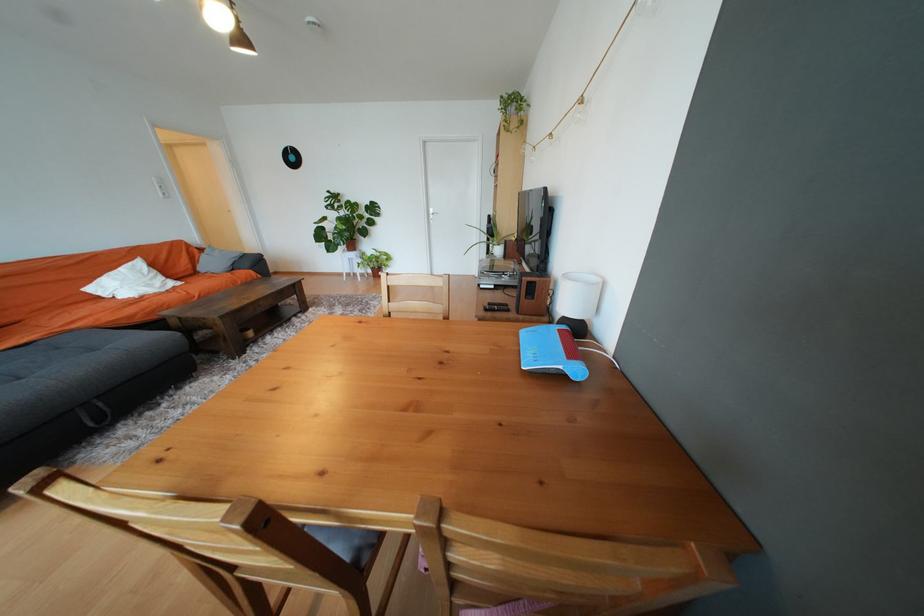
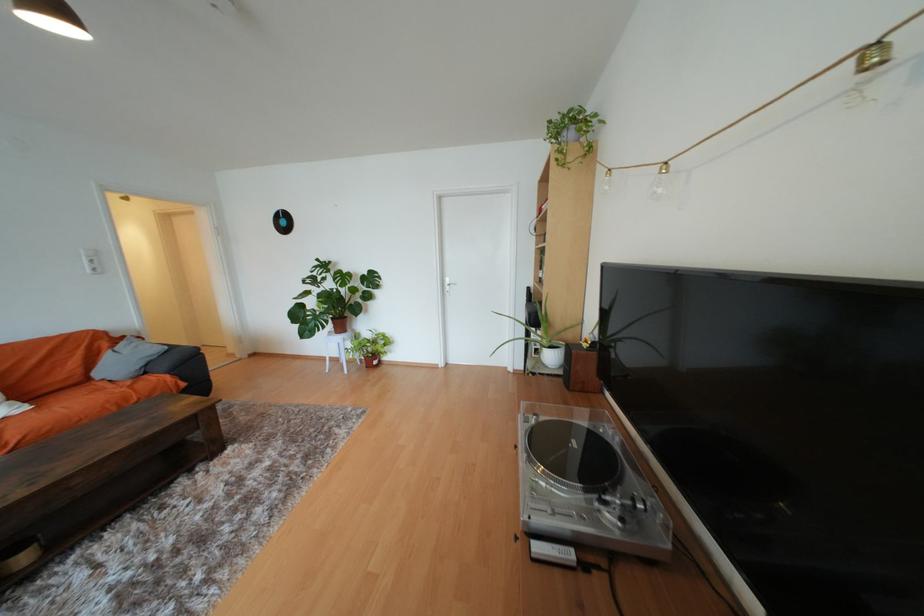
In the second image, find the point that corresponds to (x=354, y=248) in the first image.

(341, 329)